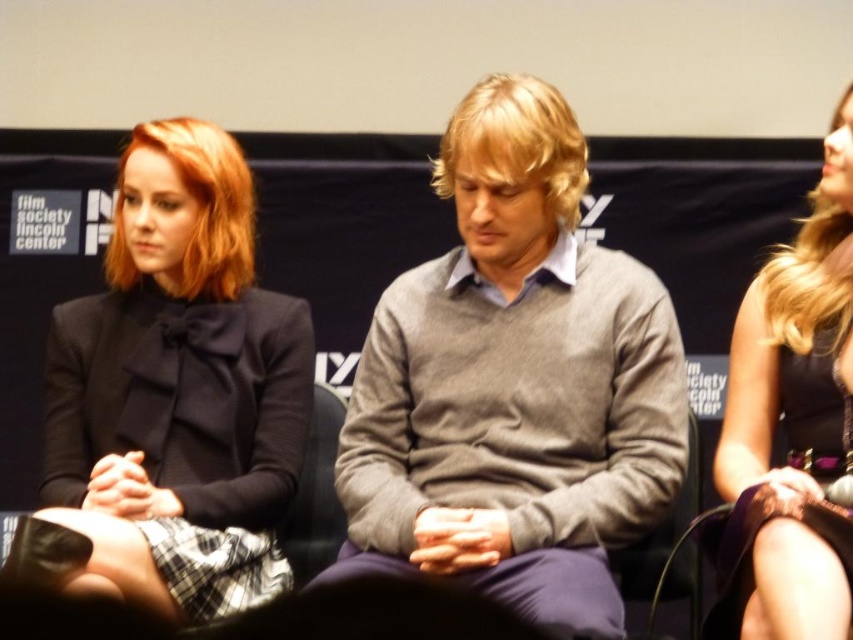
Question: Observing the image, what is the correct spatial positioning of matte black dress at left in reference to satin black dress at center?

Choices:
 (A) right
 (B) left

Answer: (B)

Question: Estimate the real-world distances between objects in this image. Which object is farther from the matte black dress at left?

Choices:
 (A) gray sweater at center
 (B) satin black dress at center

Answer: (B)

Question: Which point appears farthest from the camera in this image?

Choices:
 (A) (143, 516)
 (B) (576, 186)

Answer: (B)

Question: Is matte black dress at left to the left of satin black dress at center from the viewer's perspective?

Choices:
 (A) no
 (B) yes

Answer: (B)

Question: Can you confirm if gray sweater at center is bigger than satin black dress at center?

Choices:
 (A) yes
 (B) no

Answer: (A)

Question: Which point is farther from the camera taking this photo?

Choices:
 (A) (764, 410)
 (B) (143, 193)

Answer: (B)